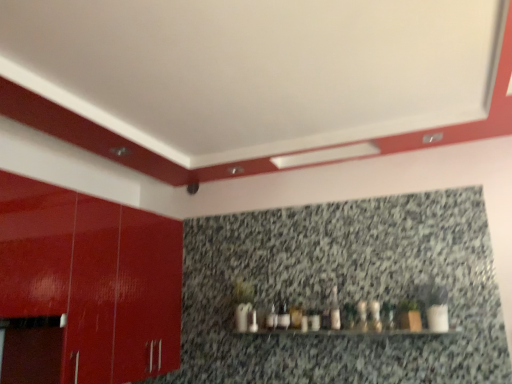
Question: Is point (370, 372) positioned closer to the camera than point (332, 299)?

Choices:
 (A) farther
 (B) closer

Answer: (B)

Question: In the image, is granite at upper center on the left side or the right side of white glossy bottle at center, arranged as the first bottle when viewed from the left?

Choices:
 (A) left
 (B) right

Answer: (A)

Question: Which of these objects is positioned closest to the granite at upper center?

Choices:
 (A) white glossy bottle at center, arranged as the first bottle when viewed from the left
 (B) matte white bottle at center, the second bottle from the left
 (C) white glossy bottle at center, the third bottle when ordered from left to right
 (D) glossy red cabinet at left

Answer: (A)

Question: Which object is positioned farthest from the white glossy bottle at center, the third bottle when ordered from left to right?

Choices:
 (A) white glossy bottle at center, arranged as the first bottle when viewed from the left
 (B) matte white bottle at center, the second bottle from the left
 (C) granite at upper center
 (D) glossy red cabinet at left

Answer: (D)